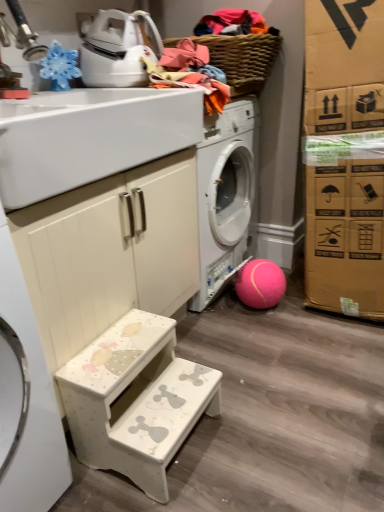
You are a GUI agent. You are given a task and a screenshot of the screen. Output one action in this format:
    pyautogui.click(x=<x>, y=<y>)
    Task: Click on the pink rubber ball at lower right
    The width and height of the screenshot is (384, 512).
    Given the screenshot: What is the action you would take?
    pyautogui.click(x=260, y=284)

What do you see at coordinates (260, 284) in the screenshot?
I see `pink rubber ball at lower right` at bounding box center [260, 284].

Locate an element on the screen. Image resolution: width=384 pixels, height=512 pixels. soft cotton clothes at upper center is located at coordinates (188, 73).

What's the angular difference between white glossy sink at upper left and soft cotton clothes at upper center's facing directions?

The angular difference between white glossy sink at upper left and soft cotton clothes at upper center is 1.96 degrees.

Is white glossy sink at upper left with soft cotton clothes at upper center?

No.

Looking at this image, is white glossy sink at upper left facing away from soft cotton clothes at upper center?

No, white glossy sink at upper left's orientation is not away from soft cotton clothes at upper center.

Which of these two, white glossy sink at upper left or soft cotton clothes at upper center, is smaller?

With smaller size is soft cotton clothes at upper center.

Considering the points (161, 336) and (92, 37), which point is behind, point (161, 336) or point (92, 37)?

The point (92, 37) is behind.

You are a GUI agent. You are given a task and a screenshot of the screen. Output one action in this format:
    pyautogui.click(x=<x>, y=<y>)
    Task: Click on the appliance located above the white painted wood step stool at lower left (from a real-world perspective)
    Image resolution: width=384 pixels, height=512 pixels.
    Given the screenshot: What is the action you would take?
    pyautogui.click(x=116, y=50)

Is white painted wood step stool at lower left closer to the viewer compared to white glossy iron at upper left?

Yes.

Is white painted wood step stool at lower left directly adjacent to white glossy iron at upper left?

No, white painted wood step stool at lower left is not beside white glossy iron at upper left.

Can you confirm if pink rubber ball at lower right is smaller than woven brown basket at upper center?

Indeed, pink rubber ball at lower right has a smaller size compared to woven brown basket at upper center.

Can you confirm if pink rubber ball at lower right is shorter than woven brown basket at upper center?

No, pink rubber ball at lower right is not shorter than woven brown basket at upper center.

In the scene shown: Is pink rubber ball at lower right positioned with its back to woven brown basket at upper center?

No, pink rubber ball at lower right is not facing the opposite direction of woven brown basket at upper center.

Would you say white painted wood cabinet at lower left is outside white glossy iron at upper left?

Indeed, white painted wood cabinet at lower left is completely outside white glossy iron at upper left.

In the image, is white painted wood cabinet at lower left on the left side or the right side of white glossy iron at upper left?

From the image, it's evident that white painted wood cabinet at lower left is to the left of white glossy iron at upper left.

Considering the sizes of objects white painted wood cabinet at lower left and white glossy iron at upper left in the image provided, who is taller, white painted wood cabinet at lower left or white glossy iron at upper left?

Standing taller between the two is white painted wood cabinet at lower left.

Image resolution: width=384 pixels, height=512 pixels. I want to click on appliance above the white painted wood cabinet at lower left (from the image's perspective), so click(x=116, y=50).

Is point (269, 60) less distant than point (126, 101)?

That is False.

Which of these two, woven brown basket at upper center or white glossy sink at upper left, is wider?

white glossy sink at upper left.

From a real-world perspective, relative to white glossy sink at upper left, is woven brown basket at upper center vertically above or below?

woven brown basket at upper center is above white glossy sink at upper left.

Is woven brown basket at upper center oriented away from white glossy sink at upper left?

No.

How far apart are white glossy sink at upper left and white painted wood cabinet at lower left?

white glossy sink at upper left and white painted wood cabinet at lower left are 7.49 inches apart from each other.

From the image's perspective, which is below, white glossy sink at upper left or white painted wood cabinet at lower left?

white painted wood cabinet at lower left.

How different are the orientations of white glossy sink at upper left and white painted wood cabinet at lower left in degrees?

0.395 degrees separate the facing orientations of white glossy sink at upper left and white painted wood cabinet at lower left.

Is white glossy sink at upper left to the left or to the right of white painted wood cabinet at lower left in the image?

white glossy sink at upper left is to the left of white painted wood cabinet at lower left.

From the image's perspective, is white glossy sink at upper left over white painted wood step stool at lower left?

Yes, from the image's perspective, white glossy sink at upper left is above white painted wood step stool at lower left.

You are a GUI agent. You are given a task and a screenshot of the screen. Output one action in this format:
    pyautogui.click(x=<x>, y=<y>)
    Task: Click on the sink that is on the left side of white painted wood step stool at lower left
    The image size is (384, 512).
    Given the screenshot: What is the action you would take?
    pyautogui.click(x=89, y=137)

In the scene shown: Is white glossy sink at upper left bigger or smaller than white painted wood step stool at lower left?

white glossy sink at upper left is bigger than white painted wood step stool at lower left.

Find the location of a particular element. The image size is (384, 512). sink located on the left of soft cotton clothes at upper center is located at coordinates (89, 137).

The width and height of the screenshot is (384, 512). In order to click on step stool that is on the right side of white glossy iron at upper left in this screenshot , I will do `click(135, 400)`.

When comparing their distances from soft cotton clothes at upper center, does white glossy iron at upper left or white glossy sink at upper left seem closer?

white glossy iron at upper left is positioned closer to the anchor soft cotton clothes at upper center.

When comparing their distances from white glossy sink at upper left, does pink rubber ball at lower right or woven brown basket at upper center seem further?

pink rubber ball at lower right.

Which object lies nearer to the anchor point woven brown basket at upper center, white glossy sink at upper left or white painted wood step stool at lower left?

white glossy sink at upper left is closer to woven brown basket at upper center.

Looking at the image, which one is located further to white painted wood step stool at lower left, pink rubber ball at lower right or woven brown basket at upper center?

The object further to white painted wood step stool at lower left is woven brown basket at upper center.

Estimate the real-world distances between objects in this image. Which object is closer to white glossy sink at upper left, white painted wood cabinet at lower left or white glossy iron at upper left?

white painted wood cabinet at lower left.

Estimate the real-world distances between objects in this image. Which object is closer to woven brown basket at upper center, white glossy iron at upper left or white painted wood cabinet at lower left?

The object closer to woven brown basket at upper center is white glossy iron at upper left.

Considering their positions, is white painted wood cabinet at lower left positioned closer to pink rubber ball at lower right than white painted wood step stool at lower left?

Among the two, white painted wood cabinet at lower left is located nearer to pink rubber ball at lower right.

When comparing their distances from soft cotton clothes at upper center, does pink rubber ball at lower right or white glossy iron at upper left seem further?

pink rubber ball at lower right is further to soft cotton clothes at upper center.

The width and height of the screenshot is (384, 512). In order to click on cabinetry between woven brown basket at upper center and white painted wood step stool at lower left from top to bottom in this screenshot , I will do [x=110, y=252].

Where is `cabinetry between white glossy sink at upper left and white painted wood step stool at lower left in the vertical direction`? cabinetry between white glossy sink at upper left and white painted wood step stool at lower left in the vertical direction is located at coordinates (110, 252).

You are a GUI agent. You are given a task and a screenshot of the screen. Output one action in this format:
    pyautogui.click(x=<x>, y=<y>)
    Task: Click on the cabinetry between white glossy sink at upper left and pink rubber ball at lower right in the front-back direction
    This screenshot has width=384, height=512.
    Given the screenshot: What is the action you would take?
    pyautogui.click(x=110, y=252)

Image resolution: width=384 pixels, height=512 pixels. Find the location of `sink between soft cotton clothes at upper center and white painted wood step stool at lower left from top to bottom`. sink between soft cotton clothes at upper center and white painted wood step stool at lower left from top to bottom is located at coordinates (89, 137).